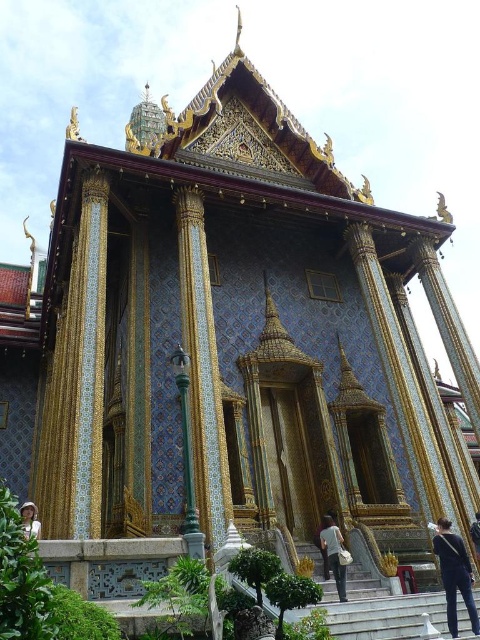
You are standing at the entrance of the temple and notice two items in the scene. The dark blue jeans at lower right and the white fabric hat at lower center. Given that you need to place a 30 meter long decorative banner between them, will the banner be long enough to stretch from one to the other?

The dark blue jeans at lower right and white fabric hat at lower center are 28.67 meters apart from each other. Since the banner is 30 meters long, it will be long enough to stretch between them with some extra length remaining.

You are standing at the entrance of the temple and want to locate the green glazed tile pillar at center. According to the coordinates provided, where should you look relative to your position?

The green glazed tile pillar at center is located at coordinates point (202, 369), which means it is positioned slightly to the right and forward from your current position at the entrance.

You are standing at the entrance of the grand temple and want to take a photo of a specific point. The temple has two large doorways with gold details. There is a point at coordinates point (195,480) that you need to capture. Considering your camera can focus on objects within 50 meters, will the point be in focus?

The distance of point (195,480) from camera is 44.76 meters, which is within the camera focus range of 50 meters. Therefore, the point will be in focus.